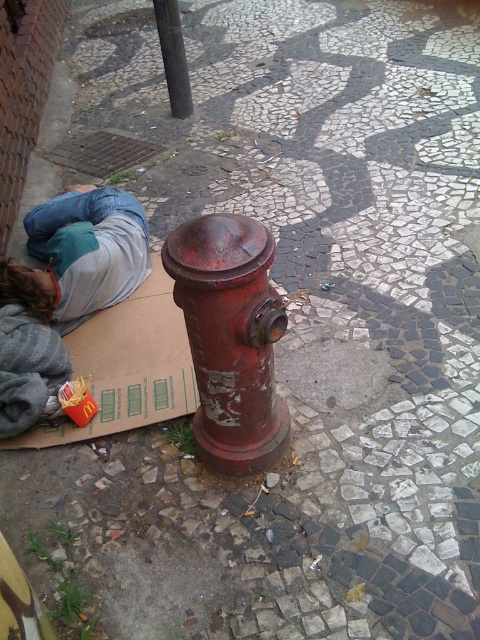
Can you confirm if denim jacket at lower left is thinner than smooth black pole at upper center?

In fact, denim jacket at lower left might be wider than smooth black pole at upper center.

Can you confirm if denim jacket at lower left is taller than smooth black pole at upper center?

Yes.

Between point (72, 230) and point (171, 108), which one is positioned behind?

The point (171, 108) is behind.

The width and height of the screenshot is (480, 640). I want to click on denim jacket at lower left, so click(80, 253).

Can you confirm if cardboard box at lower left is positioned to the left of smooth black pole at upper center?

In fact, cardboard box at lower left is to the right of smooth black pole at upper center.

The height and width of the screenshot is (640, 480). In order to click on cardboard box at lower left in this screenshot , I will do `click(128, 365)`.

Describe the element at coordinates (128, 365) in the screenshot. I see `cardboard box at lower left` at that location.

Image resolution: width=480 pixels, height=640 pixels. Identify the location of cardboard box at lower left. (128, 365).

Can you confirm if rusty metal hydrant at center is taller than smooth black pole at upper center?

Correct, rusty metal hydrant at center is much taller as smooth black pole at upper center.

Who is positioned more to the right, rusty metal hydrant at center or smooth black pole at upper center?

rusty metal hydrant at center

Is point (201, 413) positioned behind point (178, 52)?

No.

Locate an element on the screen. This screenshot has width=480, height=640. rusty metal hydrant at center is located at coordinates (230, 339).